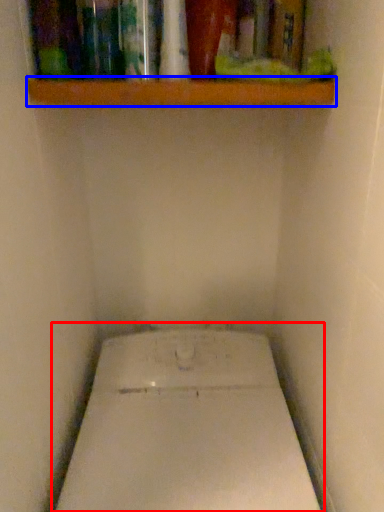
Question: Which of the following is the closest to the observer, toilet (highlighted by a red box) or shelf (highlighted by a blue box)?

Choices:
 (A) toilet
 (B) shelf

Answer: (A)